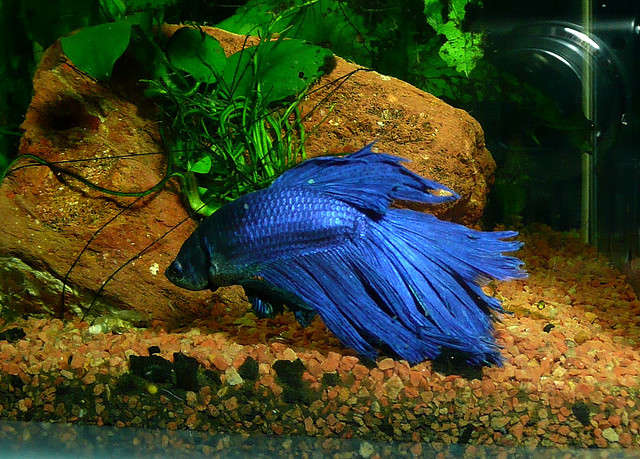
The width and height of the screenshot is (640, 459). I want to click on fish tank, so click(525, 428).